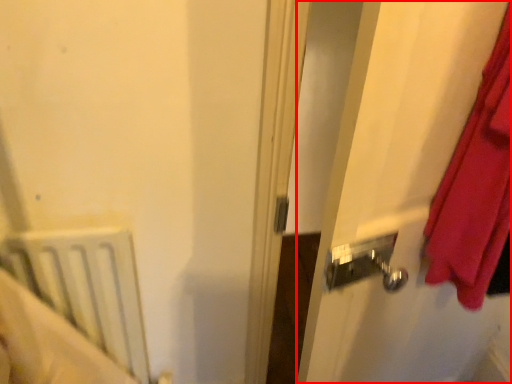
Question: Where is screen door (annotated by the red box) located in relation to radiator in the image?

Choices:
 (A) right
 (B) left

Answer: (A)